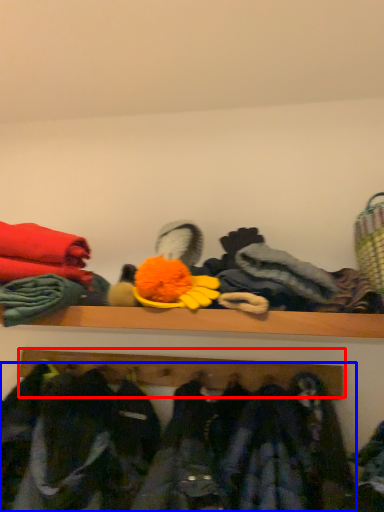
Question: Which point is closer to the camera, shelf (highlighted by a red box) or clothing (highlighted by a blue box)?

Choices:
 (A) shelf
 (B) clothing

Answer: (B)